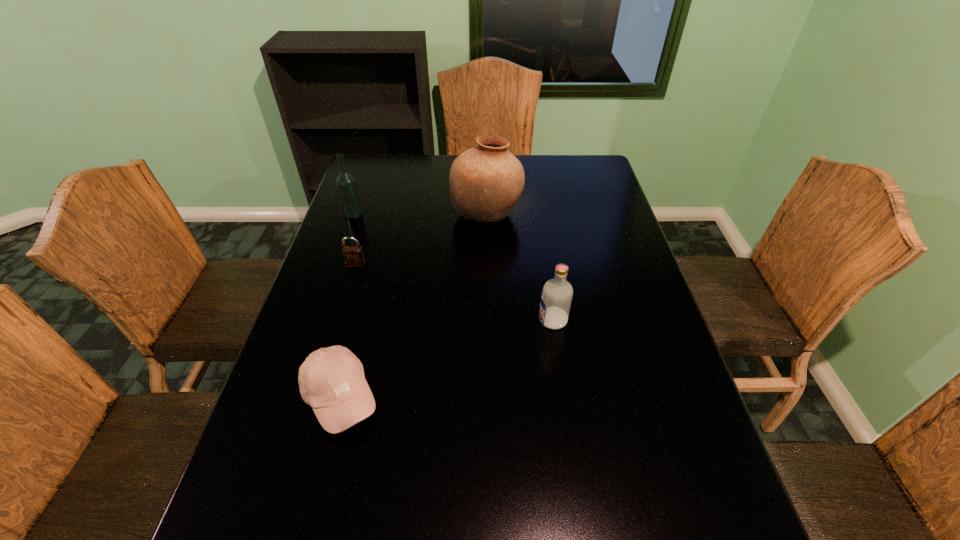
Where is `blank space located on the label of the second nearest object`? Image resolution: width=960 pixels, height=540 pixels. blank space located on the label of the second nearest object is located at coordinates (491, 320).

Locate an element on the screen. This screenshot has width=960, height=540. vacant space located on the label of the second nearest object is located at coordinates (447, 320).

At what (x,y) coordinates should I click in order to perform the action: click on free region located on the label of the second nearest object. Please return your answer as a coordinate pair (x, y). This screenshot has width=960, height=540. Looking at the image, I should click on (x=487, y=320).

Where is `vacant space located 0.400m on the front-facing side of the baseball cap`? The height and width of the screenshot is (540, 960). vacant space located 0.400m on the front-facing side of the baseball cap is located at coordinates (564, 397).

What are the coordinates of `blank space located 0.270m on the front-facing side of the padlock` in the screenshot? It's located at (332, 343).

Locate an element on the screen. The width and height of the screenshot is (960, 540). vodka that is at the left edge is located at coordinates (346, 183).

Find the location of a particular element. This screenshot has width=960, height=540. baseball cap that is at the left edge is located at coordinates (331, 380).

You are a GUI agent. You are given a task and a screenshot of the screen. Output one action in this format:
    pyautogui.click(x=<x>, y=<y>)
    Task: Click on the padlock that is at the left edge
    
    Given the screenshot: What is the action you would take?
    pyautogui.click(x=353, y=255)

In the image, there is a desktop. At what (x,y) coordinates should I click in order to perform the action: click on vacant space at the far edge. Please return your answer as a coordinate pair (x, y). Looking at the image, I should click on (530, 159).

Locate an element on the screen. This screenshot has width=960, height=540. vacant space at the left edge of the desktop is located at coordinates (317, 315).